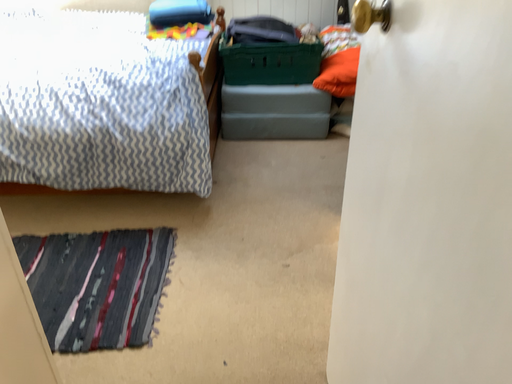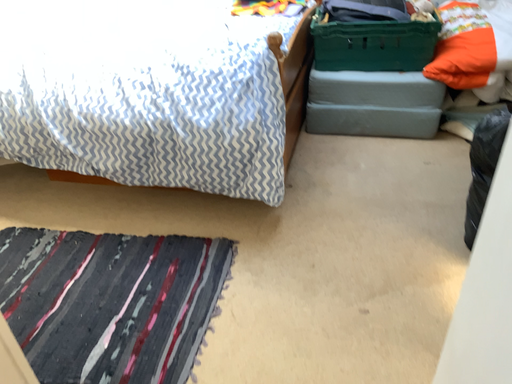
Question: How did the camera likely rotate when shooting the video?

Choices:
 (A) rotated right
 (B) rotated left

Answer: (B)